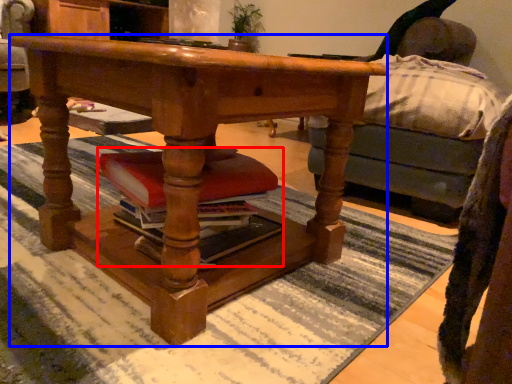
Question: Which object is closer to the camera taking this photo, book (highlighted by a red box) or desk (highlighted by a blue box)?

Choices:
 (A) book
 (B) desk

Answer: (B)